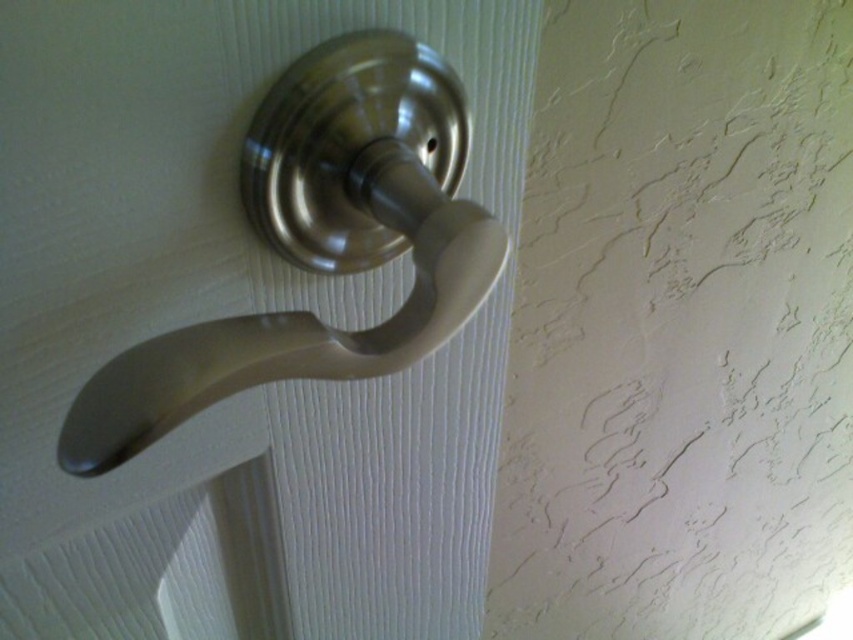
Question: Which object is farther from the camera taking this photo?

Choices:
 (A) satin nickel knob at center
 (B) satin nickel handle at center

Answer: (A)

Question: Is satin nickel handle at center to the right of satin nickel knob at center from the viewer's perspective?

Choices:
 (A) yes
 (B) no

Answer: (B)

Question: Is satin nickel handle at center behind satin nickel knob at center?

Choices:
 (A) yes
 (B) no

Answer: (B)

Question: Is satin nickel handle at center behind satin nickel knob at center?

Choices:
 (A) yes
 (B) no

Answer: (B)